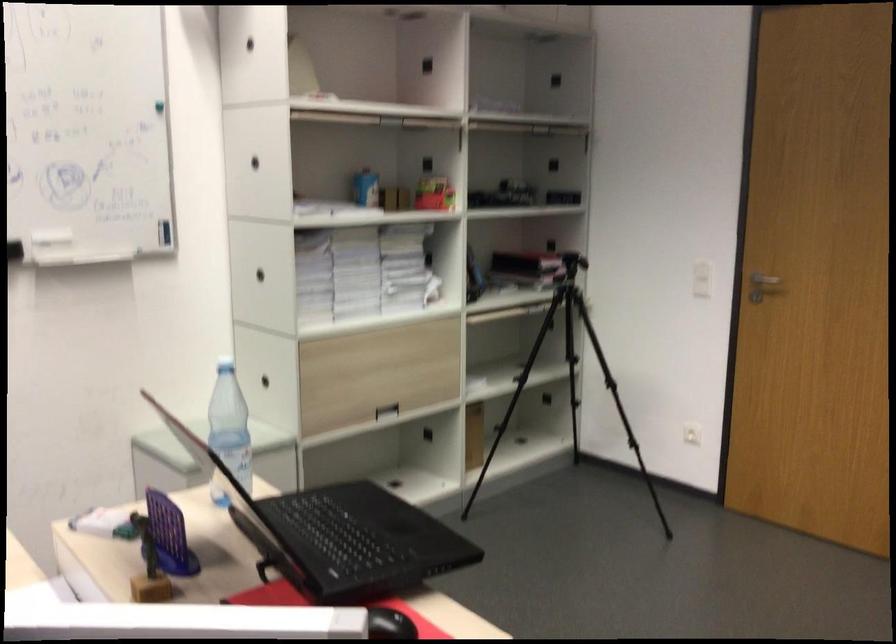
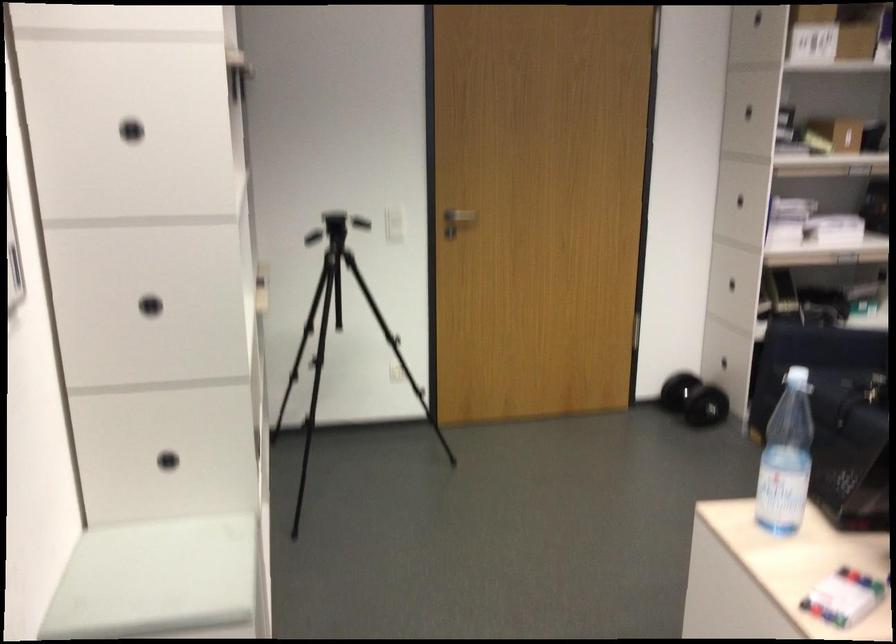
The point at (812, 283) is marked in the first image. Where is the corresponding point in the second image?

(460, 216)